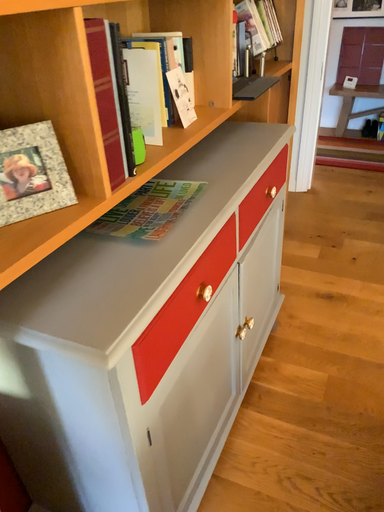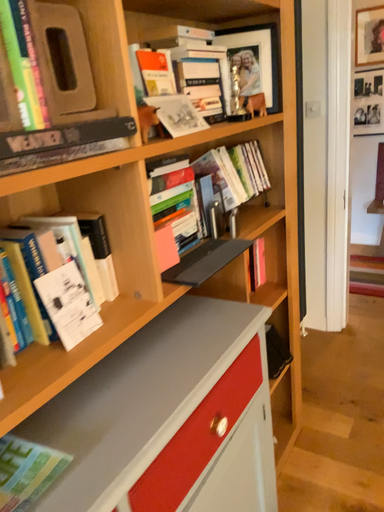
Question: Which way did the camera rotate in the video?

Choices:
 (A) rotated left
 (B) rotated right

Answer: (A)